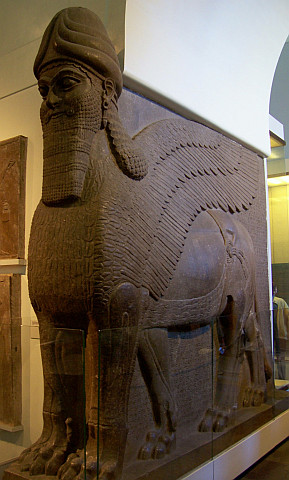
Where is `ceiling`? The width and height of the screenshot is (289, 480). ceiling is located at coordinates (14, 10).